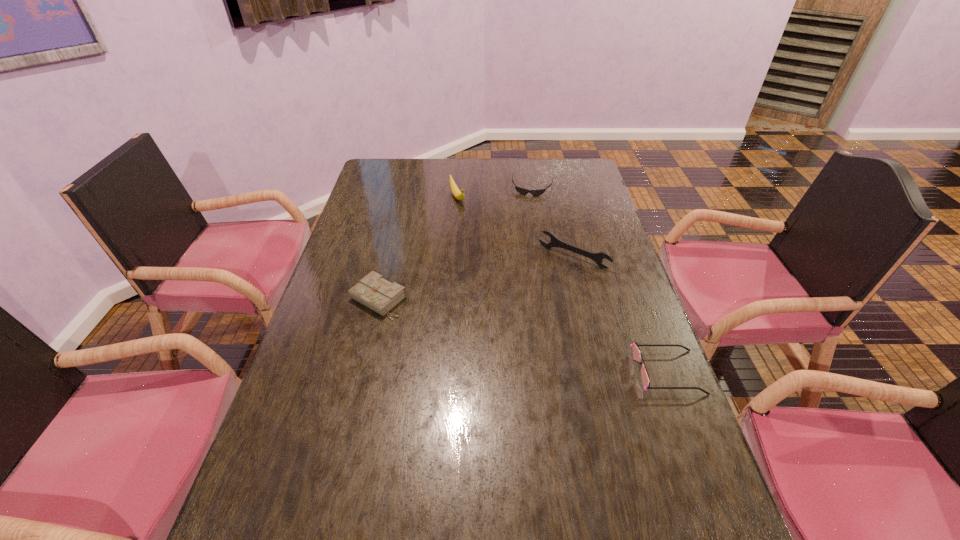
In order to click on banana that is at the far edge in this screenshot , I will do `click(456, 192)`.

This screenshot has width=960, height=540. In order to click on sunglasses present at the far edge in this screenshot , I will do tap(522, 191).

Where is `object present at the left edge`? This screenshot has height=540, width=960. object present at the left edge is located at coordinates (373, 291).

At what (x,y) coordinates should I click in order to perform the action: click on sunglasses located at the right edge. Please return your answer as a coordinate pair (x, y). Image resolution: width=960 pixels, height=540 pixels. Looking at the image, I should click on pyautogui.click(x=636, y=352).

What are the coordinates of `wrench that is at the right edge` in the screenshot? It's located at (598, 257).

Where is `vacant position at the far edge of the desktop`? The image size is (960, 540). vacant position at the far edge of the desktop is located at coordinates (548, 175).

At what (x,y) coordinates should I click in order to perform the action: click on vacant area at the near edge of the desktop. Please return your answer as a coordinate pair (x, y). Looking at the image, I should click on (550, 497).

Where is `free space at the left edge`? This screenshot has height=540, width=960. free space at the left edge is located at coordinates (308, 350).

In the image, there is a desktop. At what (x,y) coordinates should I click in order to perform the action: click on vacant space at the right edge. Please return your answer as a coordinate pair (x, y). The height and width of the screenshot is (540, 960). Looking at the image, I should click on (608, 354).

This screenshot has width=960, height=540. I want to click on vacant space at the far left corner of the desktop, so click(398, 176).